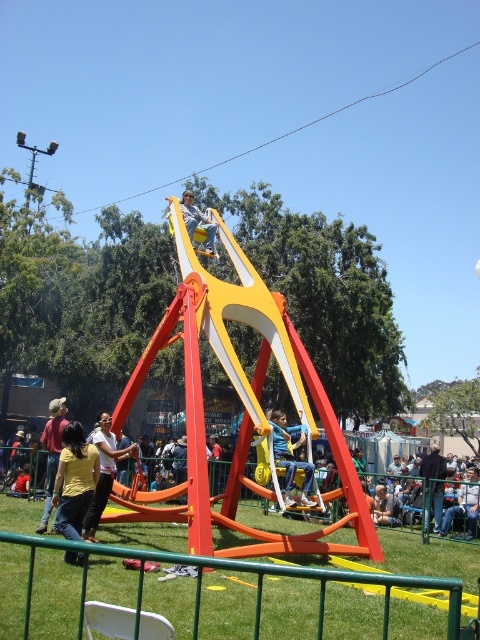
Question: Can you confirm if matte blue jeans at center is positioned to the left of yellow fabric helmet at center?

Choices:
 (A) no
 (B) yes

Answer: (A)

Question: Is yellow matte swing at center thinner than yellow fabric shirt at center?

Choices:
 (A) no
 (B) yes

Answer: (A)

Question: Estimate the real-world distances between objects in this image. Which object is farther from the yellow matte swing at center?

Choices:
 (A) yellow fabric helmet at center
 (B) matte blue jeans at center
 (C) dark blue jeans at lower right
 (D) yellow fabric shirt at center

Answer: (A)

Question: Which point is farther to the camera?

Choices:
 (A) matte blue jeans at center
 (B) yellow fabric shirt at center

Answer: (A)

Question: Which point appears closest to the camera in this image?

Choices:
 (A) (191, 195)
 (B) (432, 472)

Answer: (A)

Question: Is yellow matte swing at center wider than yellow fabric helmet at center?

Choices:
 (A) no
 (B) yes

Answer: (B)